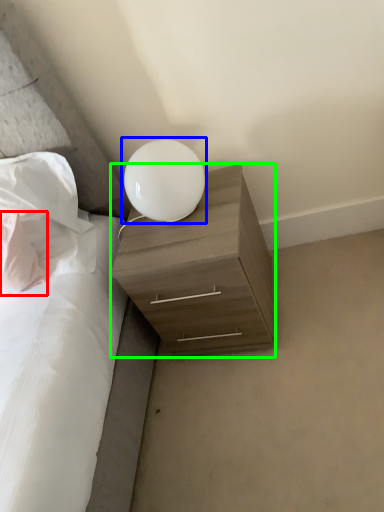
Question: Estimate the real-world distances between objects in this image. Which object is closer to pillow (highlighted by a red box), lamp (highlighted by a blue box) or nightstand (highlighted by a green box)?

Choices:
 (A) lamp
 (B) nightstand

Answer: (A)